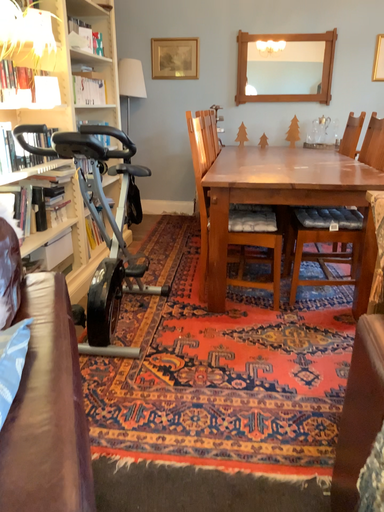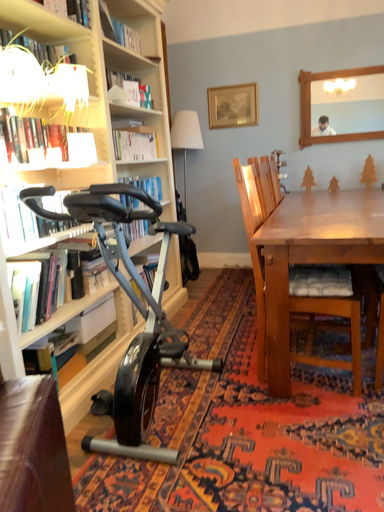
Question: Which way did the camera rotate in the video?

Choices:
 (A) rotated right
 (B) rotated left

Answer: (B)